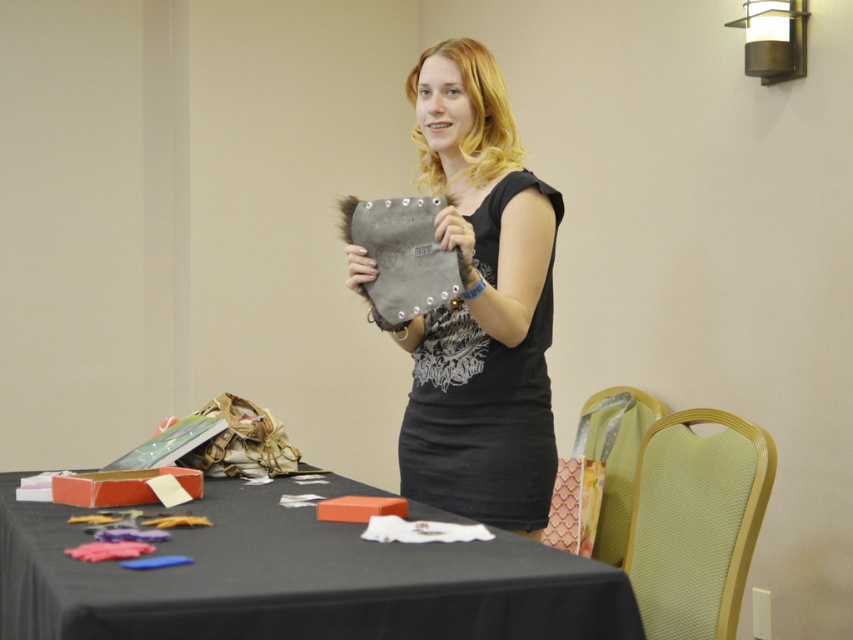
Question: Which point is closer to the camera taking this photo?

Choices:
 (A) (550, 225)
 (B) (167, 621)

Answer: (B)

Question: Is black fabric table at lower left to the right of matte gray pouch at center from the viewer's perspective?

Choices:
 (A) no
 (B) yes

Answer: (A)

Question: Can you confirm if black fabric table at lower left is bigger than matte gray pouch at center?

Choices:
 (A) yes
 (B) no

Answer: (A)

Question: Is black fabric table at lower left above matte gray pouch at center?

Choices:
 (A) no
 (B) yes

Answer: (A)